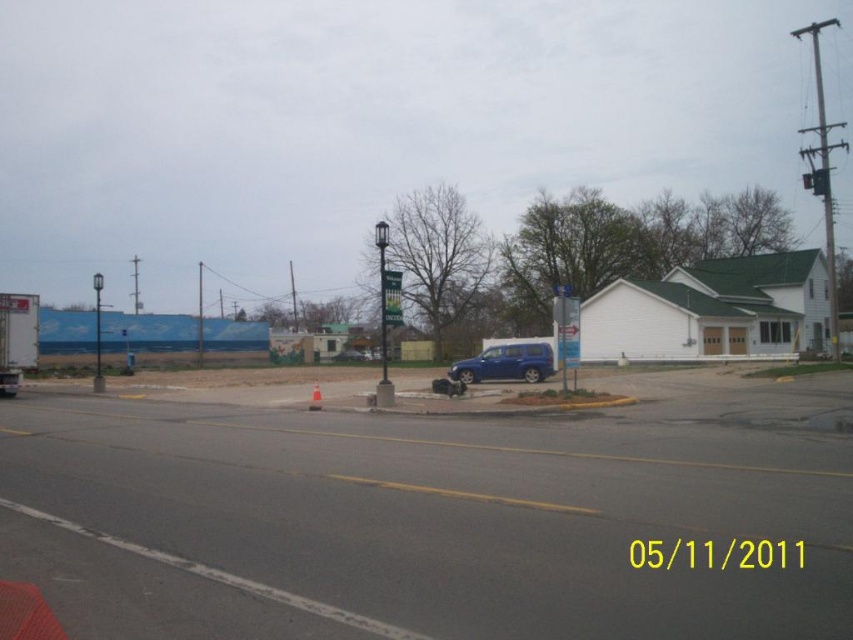
Consider the image. Is blue matte suv at center to the left of white plastic cone at center from the viewer's perspective?

No, blue matte suv at center is not to the left of white plastic cone at center.

Who is more distant from viewer, (x=474, y=356) or (x=312, y=394)?

The point (x=474, y=356) is behind.

Between point (474, 358) and point (318, 390), which one is positioned in front?

Point (318, 390)

Find the location of `blue matte suv at center`. blue matte suv at center is located at coordinates (506, 364).

Does point (532, 352) come farther from viewer compared to point (386, 304)?

Yes, point (532, 352) is behind point (386, 304).

Between point (546, 374) and point (398, 292), which one is positioned in front?

Point (398, 292) is more forward.

This screenshot has width=853, height=640. What are the coordinates of `blue matte suv at center` in the screenshot? It's located at (506, 364).

Is green fabric banner at center above white plastic cone at center?

Yes, green fabric banner at center is above white plastic cone at center.

Is point (389, 300) positioned in front of point (315, 388)?

Yes, point (389, 300) is closer to viewer.

Measure the distance between green fabric banner at center and camera.

green fabric banner at center and camera are 24.56 meters apart from each other.

Where is `green fabric banner at center`? The width and height of the screenshot is (853, 640). green fabric banner at center is located at coordinates (392, 298).